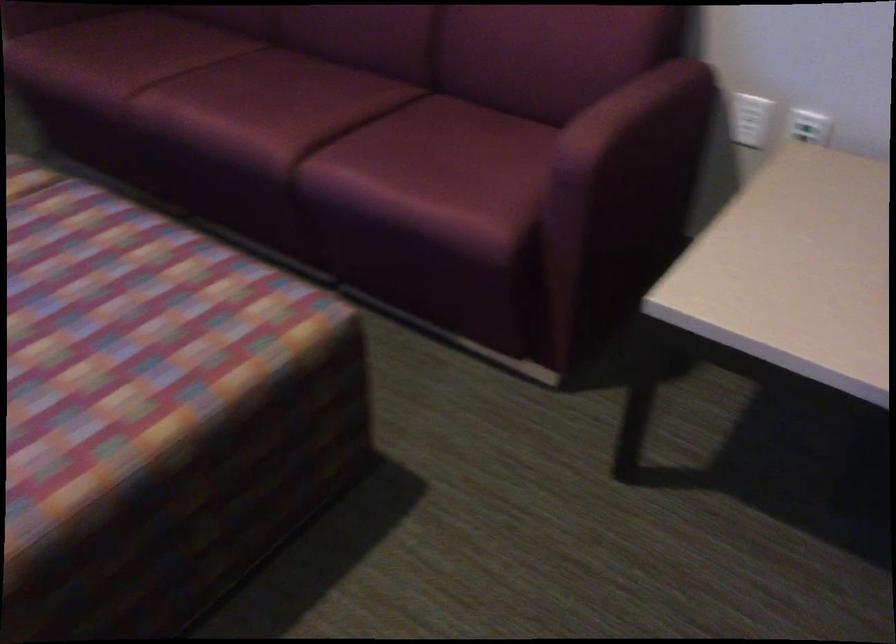
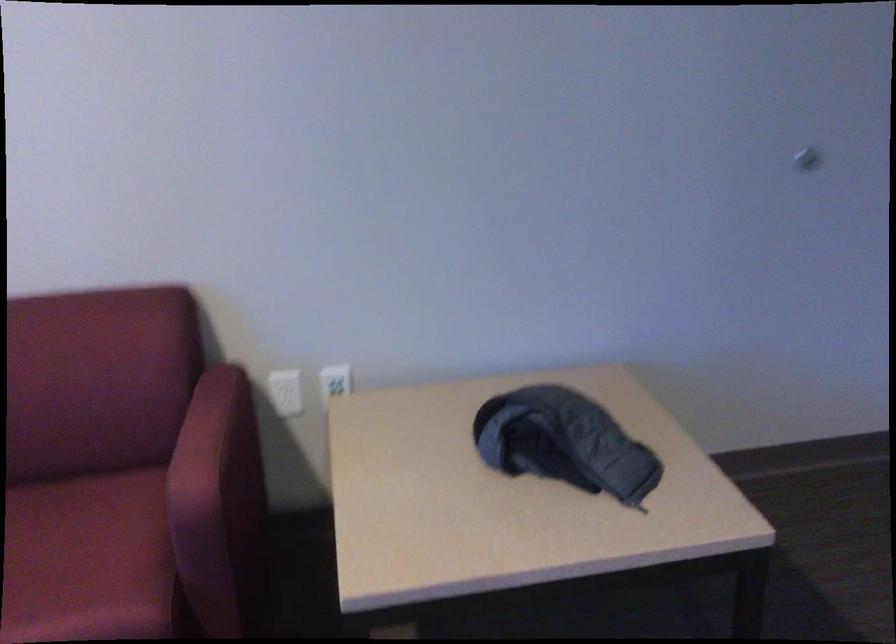
Where in the second image is the point corresponding to pixel 582 166 from the first image?

(204, 504)